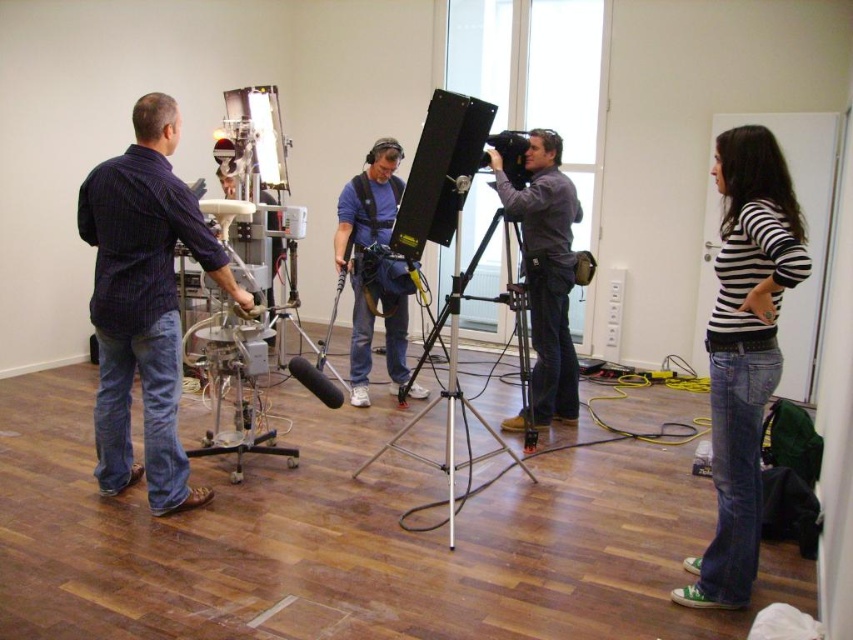
Does striped cotton shirt at right appear under matte blue shirt at center?

Yes, striped cotton shirt at right is below matte blue shirt at center.

Can you confirm if striped cotton shirt at right is wider than matte blue shirt at center?

No.

Does point (732, 451) come farther from viewer compared to point (355, 211)?

That is False.

The width and height of the screenshot is (853, 640). What are the coordinates of `striped cotton shirt at right` in the screenshot? It's located at (744, 349).

Who is more forward, (94, 273) or (389, 163)?

Point (94, 273) is in front.

Which is more to the right, blue striped shirt at left or matte blue shirt at center?

Positioned to the right is matte blue shirt at center.

Locate an element on the screen. blue striped shirt at left is located at coordinates (144, 301).

Describe the element at coordinates (450, 374) in the screenshot. The height and width of the screenshot is (640, 853). I see `white metallic tripod at center` at that location.

Is white metallic tripod at center positioned before black plastic video camera at center?

Yes, white metallic tripod at center is closer to the viewer.

This screenshot has width=853, height=640. What do you see at coordinates (450, 374) in the screenshot? I see `white metallic tripod at center` at bounding box center [450, 374].

Where is `white metallic tripod at center`? The height and width of the screenshot is (640, 853). white metallic tripod at center is located at coordinates (450, 374).